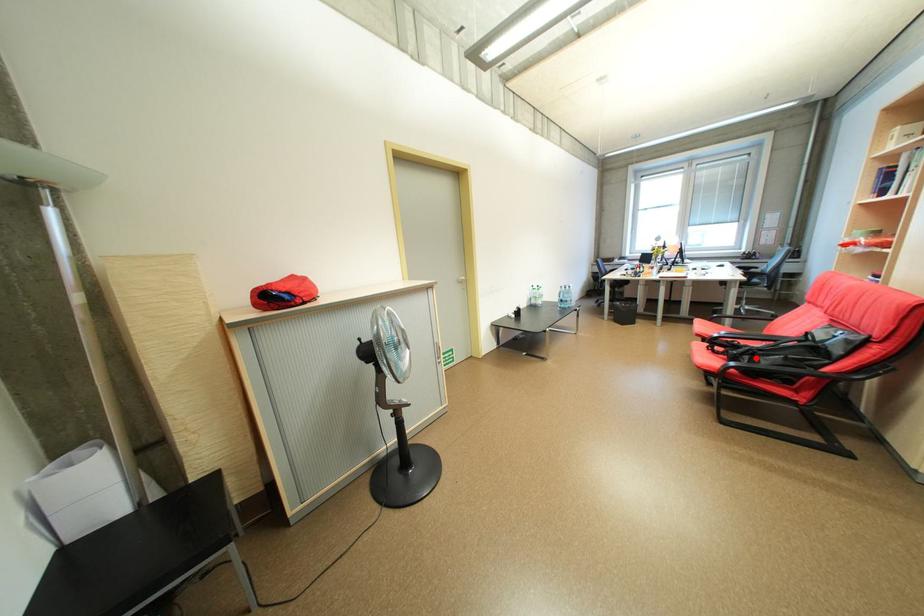
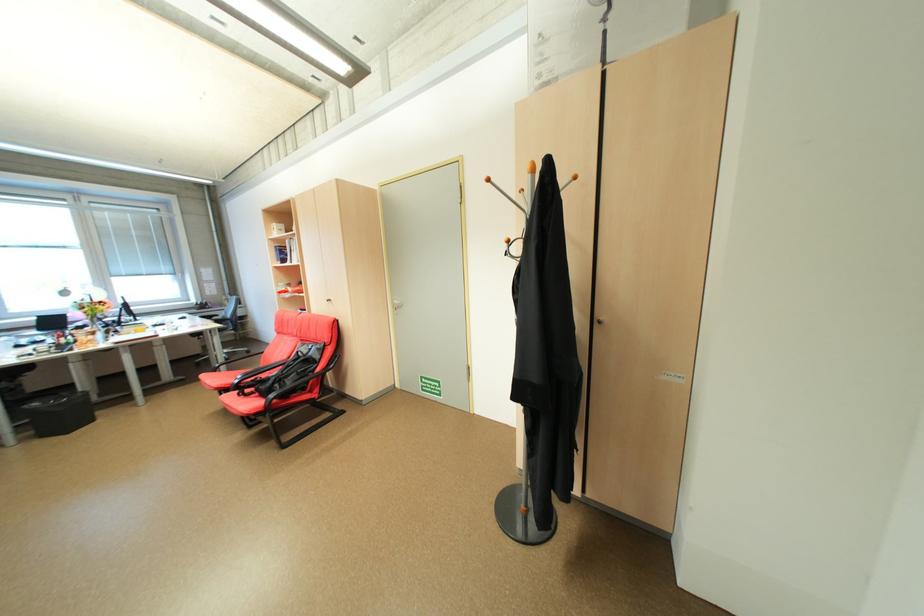
Find the pixel in the second image that matches the highlighted location in the first image.

(286, 386)